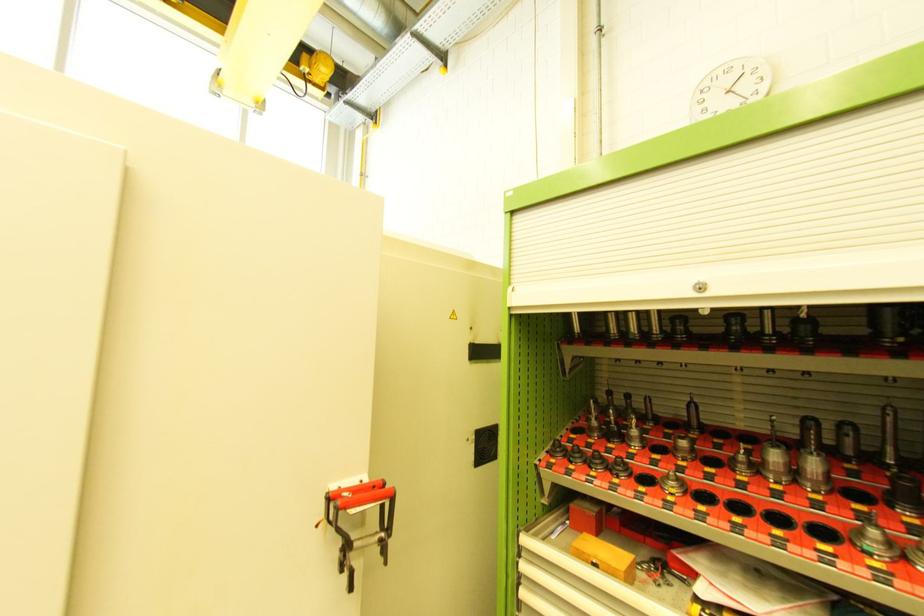
Where would you pull the cabinet shutter handle? Please return your answer as a coordinate pair (x, y).

(734, 302)